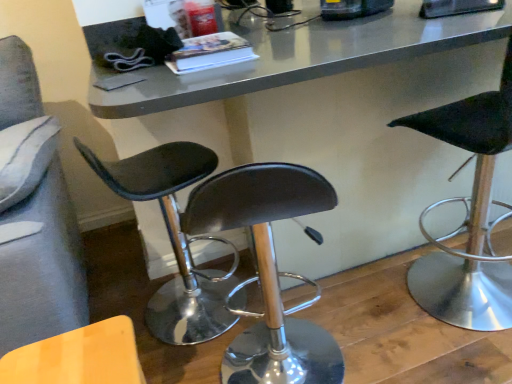
Measure the distance between point (496, 330) and camera.

They are 1.32 meters apart.

Locate an element on the screen. metallic gray table at center is located at coordinates (303, 58).

From the image's perspective, would you say metallic gray table at center is shown under wooden textured chair at lower left, the 3th chair when ordered from right to left?

Incorrect, from the image's perspective, metallic gray table at center is higher than wooden textured chair at lower left, the 3th chair when ordered from right to left.

Is metallic gray table at center at the right side of wooden textured chair at lower left, the first chair positioned from the left?

Yes.

Is metallic gray table at center positioned behind wooden textured chair at lower left, the 3th chair when ordered from right to left?

Yes, metallic gray table at center is behind wooden textured chair at lower left, the 3th chair when ordered from right to left.

Does metallic gray table at center have a smaller size compared to wooden textured chair at lower left, the first chair positioned from the left?

Incorrect, metallic gray table at center is not smaller in size than wooden textured chair at lower left, the first chair positioned from the left.

Could you tell me if wooden textured chair at lower left, the first chair positioned from the left, is turned towards black leather stool at center, positioned as the second chair in left-to-right order?

No, wooden textured chair at lower left, the first chair positioned from the left, is not aimed at black leather stool at center, positioned as the second chair in left-to-right order.

Looking at this image, considering the sizes of objects wooden textured chair at lower left, the first chair positioned from the left, and black leather stool at center, positioned as the second chair in left-to-right order, in the image provided, who is taller, wooden textured chair at lower left, the first chair positioned from the left, or black leather stool at center, positioned as the second chair in left-to-right order,?

Standing taller between the two is black leather stool at center, positioned as the second chair in left-to-right order.

At what (x,y) coordinates should I click in order to perform the action: click on the 1st chair in front when counting from the black leather stool at center, positioned as the second chair in left-to-right order. Please return your answer as a coordinate pair (x, y). Looking at the image, I should click on (78, 357).

Considering the positions of objects wooden textured chair at lower left, the 3th chair when ordered from right to left, and black leather stool at center, positioned as the second chair in left-to-right order, in the image provided, who is more to the right, wooden textured chair at lower left, the 3th chair when ordered from right to left, or black leather stool at center, positioned as the second chair in left-to-right order,?

Positioned to the right is black leather stool at center, positioned as the second chair in left-to-right order.

From the black leather stool at right, the third chair from the left, count 1st chairs backward and point to it. Please provide its 2D coordinates.

[(78, 357)]

From the picture: Could you tell me if black leather stool at right, the 1th chair viewed from the right, is facing wooden textured chair at lower left, the 3th chair when ordered from right to left?

No, black leather stool at right, the 1th chair viewed from the right, is not turned towards wooden textured chair at lower left, the 3th chair when ordered from right to left.

How far apart are black leather stool at right, the 1th chair viewed from the right, and wooden textured chair at lower left, the 3th chair when ordered from right to left?

black leather stool at right, the 1th chair viewed from the right, is 3.70 feet away from wooden textured chair at lower left, the 3th chair when ordered from right to left.

From the picture: Which object is positioned more to the left, black leather stool at right, the third chair from the left, or wooden textured chair at lower left, the first chair positioned from the left?

wooden textured chair at lower left, the first chair positioned from the left, is more to the left.

How different are the orientations of metallic gray table at center and black leather stool at center, which ranks as the 2th chair in right-to-left order, in degrees?

The facing directions of metallic gray table at center and black leather stool at center, which ranks as the 2th chair in right-to-left order, are 90.9 degrees apart.

From a real-world perspective, between metallic gray table at center and black leather stool at center, positioned as the second chair in left-to-right order, who is vertically higher?

metallic gray table at center.

Does metallic gray table at center turn towards black leather stool at center, which ranks as the 2th chair in right-to-left order?

No, metallic gray table at center does not turn towards black leather stool at center, which ranks as the 2th chair in right-to-left order.

Which is in front, point (108, 333) or point (472, 109)?

The point (108, 333) is in front.

Who is bigger, wooden textured chair at lower left, the 3th chair when ordered from right to left, or metallic gray table at center?

Bigger between the two is metallic gray table at center.

How many degrees apart are the facing directions of wooden textured chair at lower left, the first chair positioned from the left, and metallic gray table at center?

179 degrees.

Is wooden textured chair at lower left, the first chair positioned from the left, facing away from metallic gray table at center?

No, wooden textured chair at lower left, the first chair positioned from the left, is not facing away from metallic gray table at center.

In terms of height, does black leather stool at right, the third chair from the left, look taller or shorter compared to black leather stool at center, positioned as the second chair in left-to-right order?

Considering their sizes, black leather stool at right, the third chair from the left, has more height than black leather stool at center, positioned as the second chair in left-to-right order.

Considering the points (488, 315) and (182, 170), which point is in front, point (488, 315) or point (182, 170)?

The point (182, 170) is more forward.

How different are the orientations of black leather stool at right, the 1th chair viewed from the right, and black leather stool at center, which ranks as the 2th chair in right-to-left order, in degrees?

96.2 degrees.

Is black leather stool at right, the third chair from the left, to the right of black leather stool at center, which ranks as the 2th chair in right-to-left order, from the viewer's perspective?

Correct, you'll find black leather stool at right, the third chair from the left, to the right of black leather stool at center, which ranks as the 2th chair in right-to-left order.

Does wooden textured chair at lower left, the 3th chair when ordered from right to left, touch black leather stool at right, the 1th chair viewed from the right?

No, wooden textured chair at lower left, the 3th chair when ordered from right to left, is not touching black leather stool at right, the 1th chair viewed from the right.

Is black leather stool at right, the 1th chair viewed from the right, at the back of wooden textured chair at lower left, the first chair positioned from the left?

No, black leather stool at right, the 1th chair viewed from the right, is not at the back of wooden textured chair at lower left, the first chair positioned from the left.

From the image's perspective, is wooden textured chair at lower left, the first chair positioned from the left, on top of black leather stool at right, the 1th chair viewed from the right?

No, from the image's perspective, wooden textured chair at lower left, the first chair positioned from the left, is not over black leather stool at right, the 1th chair viewed from the right.

Starting from the black leather stool at right, the third chair from the left, which chair is the 1st one behind? Please provide its 2D coordinates.

[(78, 357)]

This screenshot has width=512, height=384. Identify the location of table behind the wooden textured chair at lower left, the 3th chair when ordered from right to left. tap(303, 58).

There is a wooden textured chair at lower left, the first chair positioned from the left. What are the coordinates of `the 1st chair above it (from a real-world perspective)` in the screenshot? It's located at (174, 239).

Based on the photo, when comparing their distances from metallic gray table at center, does black leather stool at right, the third chair from the left, or wooden textured chair at lower left, the 3th chair when ordered from right to left, seem further?

wooden textured chair at lower left, the 3th chair when ordered from right to left, is positioned further to the anchor metallic gray table at center.

Considering their positions, is black leather stool at center, positioned as the second chair in left-to-right order, positioned further to wooden textured chair at lower left, the first chair positioned from the left, than black leather stool at right, the 1th chair viewed from the right?

black leather stool at right, the 1th chair viewed from the right, is further to wooden textured chair at lower left, the first chair positioned from the left.

When comparing their distances from black leather stool at center, which ranks as the 2th chair in right-to-left order, does black leather stool at right, the 1th chair viewed from the right, or metallic gray table at center seem further?

black leather stool at right, the 1th chair viewed from the right, is further to black leather stool at center, which ranks as the 2th chair in right-to-left order.

From the image, which object appears to be farther from wooden textured chair at lower left, the 3th chair when ordered from right to left, metallic gray table at center or black leather stool at right, the third chair from the left?

black leather stool at right, the third chair from the left, is further to wooden textured chair at lower left, the 3th chair when ordered from right to left.

Considering their positions, is black leather stool at right, the 1th chair viewed from the right, positioned further to wooden textured chair at lower left, the first chair positioned from the left, than metallic gray table at center?

black leather stool at right, the 1th chair viewed from the right.

Consider the image. From the image, which object appears to be nearer to black leather stool at right, the third chair from the left, metallic gray table at center or black leather stool at center, positioned as the second chair in left-to-right order?

metallic gray table at center.

Based on their spatial positions, is black leather stool at center, positioned as the second chair in left-to-right order, or wooden textured chair at lower left, the 3th chair when ordered from right to left, closer to metallic gray table at center?

black leather stool at center, positioned as the second chair in left-to-right order, is closer to metallic gray table at center.

Estimate the real-world distances between objects in this image. Which object is further from wooden textured chair at lower left, the 3th chair when ordered from right to left, metallic gray table at center or black leather stool at center, which ranks as the 2th chair in right-to-left order?

metallic gray table at center is further to wooden textured chair at lower left, the 3th chair when ordered from right to left.

Find the location of a particular element. table between wooden textured chair at lower left, the 3th chair when ordered from right to left, and black leather stool at right, the 1th chair viewed from the right is located at coordinates (303, 58).

Where is `table situated between black leather stool at center, positioned as the second chair in left-to-right order, and black leather stool at right, the third chair from the left, from left to right`? Image resolution: width=512 pixels, height=384 pixels. table situated between black leather stool at center, positioned as the second chair in left-to-right order, and black leather stool at right, the third chair from the left, from left to right is located at coordinates (303, 58).

Image resolution: width=512 pixels, height=384 pixels. I want to click on chair between wooden textured chair at lower left, the 3th chair when ordered from right to left, and black leather stool at right, the 1th chair viewed from the right, in the horizontal direction, so click(x=174, y=239).

Identify the location of chair located between wooden textured chair at lower left, the 3th chair when ordered from right to left, and metallic gray table at center in the left-right direction. (174, 239).